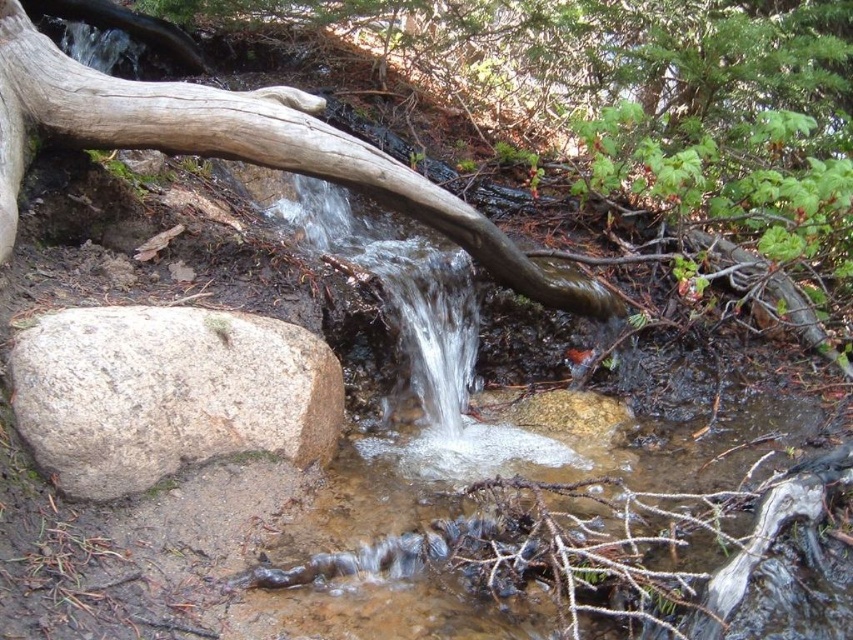
Question: Does gray rough rock at lower left appear under smooth brown log at center?

Choices:
 (A) yes
 (B) no

Answer: (A)

Question: Which of the following is the farthest from the observer?

Choices:
 (A) (323, 106)
 (B) (186, 460)

Answer: (A)

Question: Where is gray rough rock at lower left located in relation to smooth brown log at center in the image?

Choices:
 (A) below
 (B) above

Answer: (A)

Question: Which point appears farthest from the camera in this image?

Choices:
 (A) (148, 132)
 (B) (142, 467)

Answer: (A)

Question: Can you confirm if gray rough rock at lower left is thinner than smooth brown log at center?

Choices:
 (A) yes
 (B) no

Answer: (A)